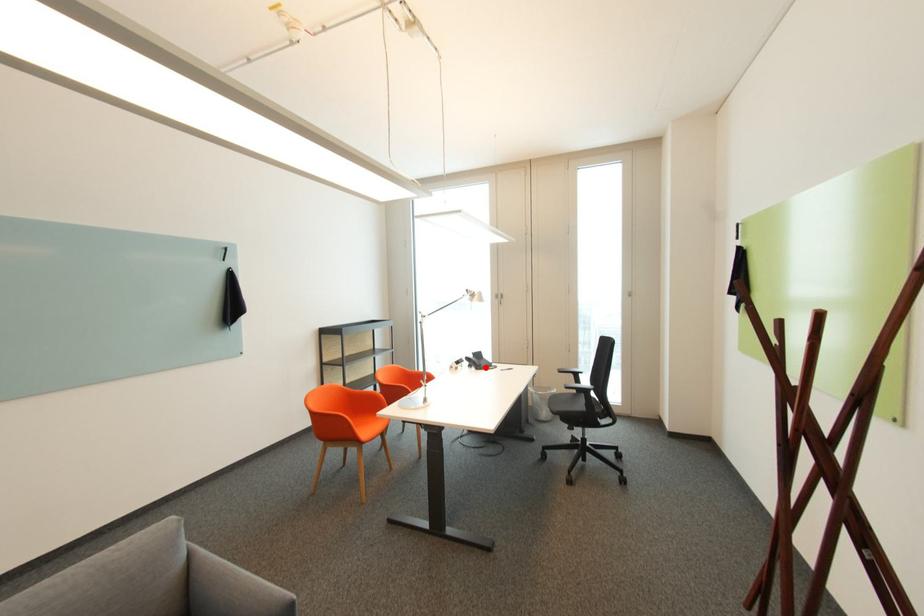
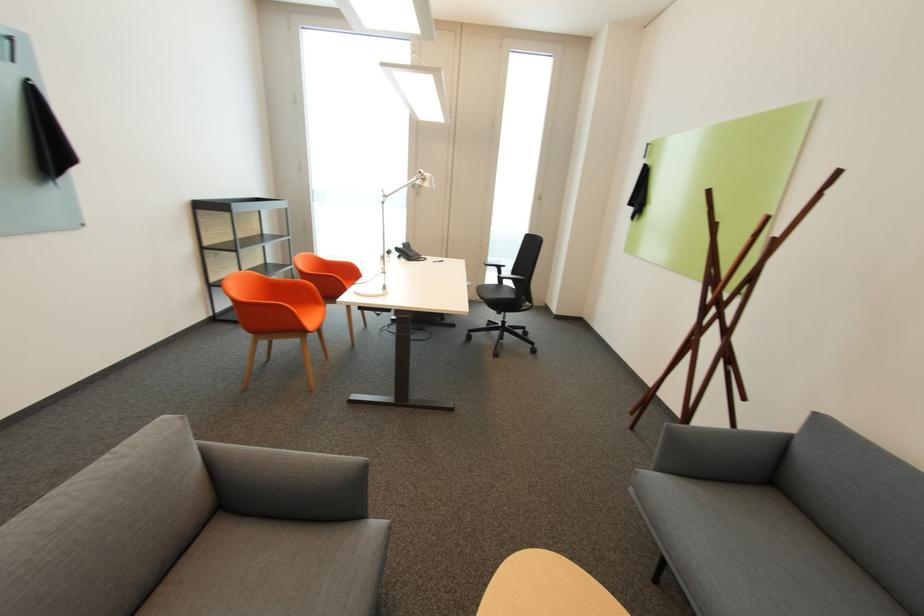
Locate, in the second image, the point that corresponds to the highlighted location in the first image.

(419, 259)